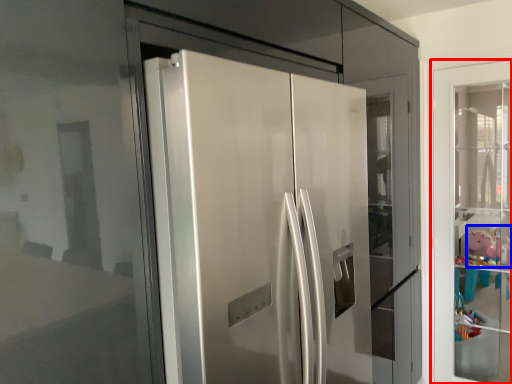
Question: Which of the following is the farthest to the observer, door (highlighted by a red box) or toy (highlighted by a blue box)?

Choices:
 (A) door
 (B) toy

Answer: (B)